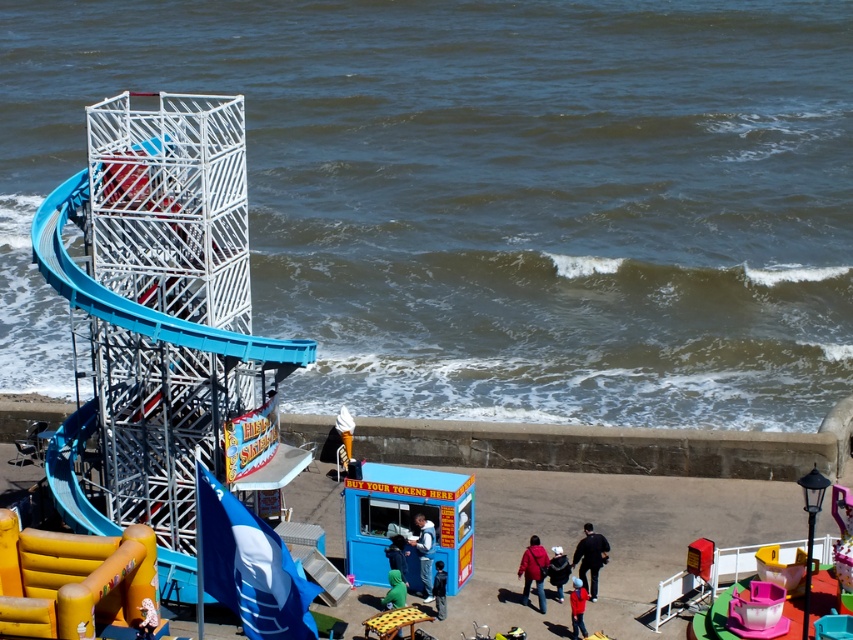
You are planning to set up a new attraction next to the yellow inflatable slide at lower left and the green fabric at lower center. Considering their sizes, which one should you place closer to the entrance to maximize visibility?

The yellow inflatable slide at lower left is larger in size compared to the green fabric at lower center, so placing it closer to the entrance would maximize visibility.

You are standing at the entrance of the fairground and see the white cotton hoodie at center and the red cotton shirt at lower center. Which clothing item is closer to you?

The white cotton hoodie at center is closer to you because it is further to the viewer than the red cotton shirt at lower center.